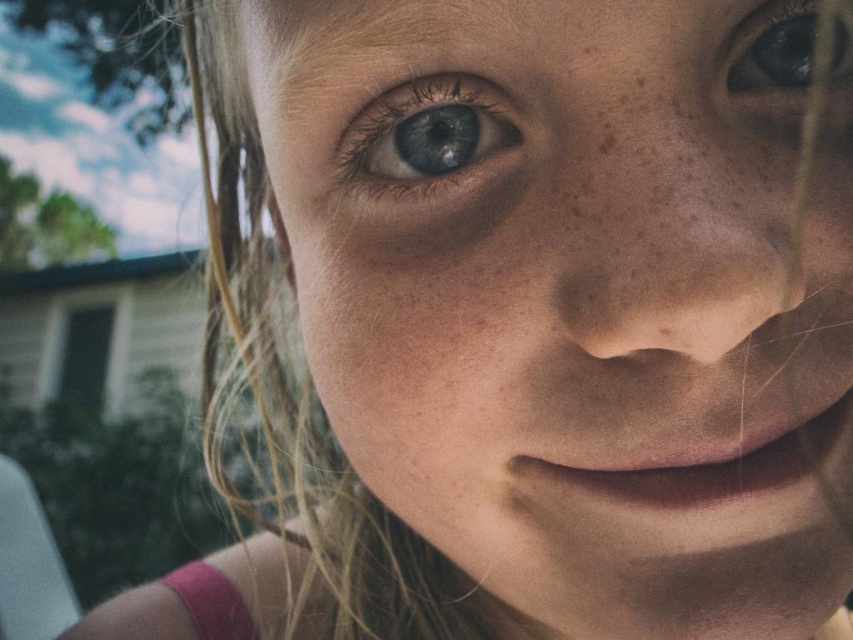
Question: Which point is farther to the camera?

Choices:
 (A) smooth skin face at center
 (B) blue matte eye at center

Answer: (B)

Question: Is smooth skin face at center to the right of blue matte eye at center from the viewer's perspective?

Choices:
 (A) yes
 (B) no

Answer: (A)

Question: Which point appears closest to the camera in this image?

Choices:
 (A) (514, 536)
 (B) (728, 67)

Answer: (B)

Question: Is smooth skin face at center thinner than blue glossy eye at upper right?

Choices:
 (A) no
 (B) yes

Answer: (A)

Question: Which object appears farthest from the camera in this image?

Choices:
 (A) blue glossy eye at upper right
 (B) blue matte eye at center
 (C) smooth skin face at center

Answer: (A)

Question: Does blue matte eye at center have a larger size compared to blue glossy eye at upper right?

Choices:
 (A) yes
 (B) no

Answer: (A)